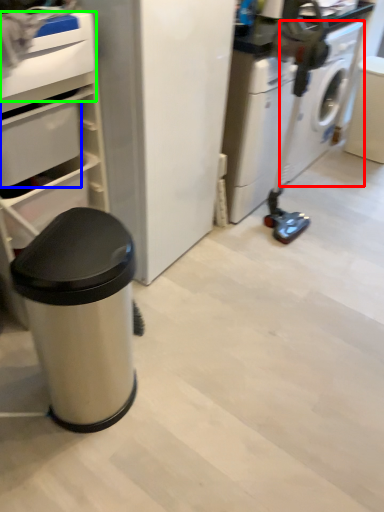
Question: Considering the real-world distances, which object is closest to washing machine (highlighted by a red box)? drawer (highlighted by a blue box) or drawer (highlighted by a green box).

Choices:
 (A) drawer
 (B) drawer

Answer: (A)